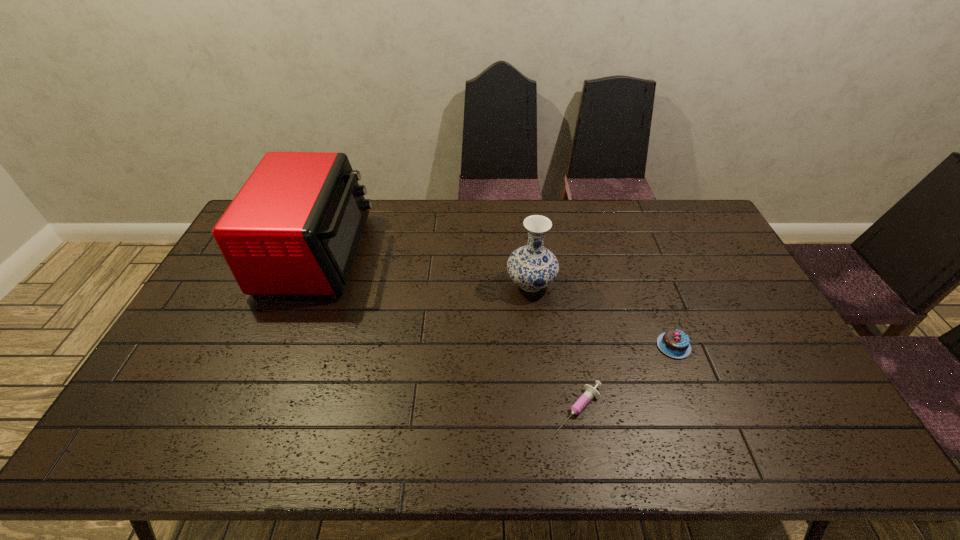
The width and height of the screenshot is (960, 540). Identify the location of object situated at the far edge. (294, 228).

Where is `object present at the near edge`? The width and height of the screenshot is (960, 540). object present at the near edge is located at coordinates (591, 392).

Identify the location of object at the left edge. (294, 228).

The image size is (960, 540). In order to click on object positioned at the far left corner in this screenshot , I will do `click(294, 228)`.

Where is `vacant space at the far edge of the desktop`? Image resolution: width=960 pixels, height=540 pixels. vacant space at the far edge of the desktop is located at coordinates point(423,213).

Identify the location of free location at the near edge of the desktop. (737, 429).

This screenshot has width=960, height=540. Identify the location of free space at the left edge of the desktop. (203, 404).

Locate an element on the screen. free space at the right edge of the desktop is located at coordinates (725, 323).

At what (x,y) coordinates should I click in order to perform the action: click on vacant region at the near left corner. Please return your answer as a coordinate pair (x, y). The height and width of the screenshot is (540, 960). Looking at the image, I should click on (161, 454).

In the image, there is a desktop. Where is `free region at the far right corner`? The image size is (960, 540). free region at the far right corner is located at coordinates (667, 204).